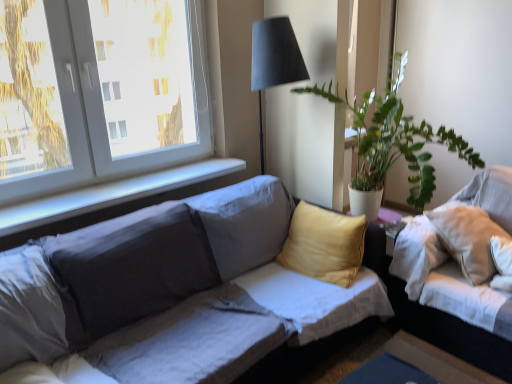
The height and width of the screenshot is (384, 512). In order to click on free region under white plastic window at upper left (from a real-world perspective) in this screenshot , I will do `click(117, 179)`.